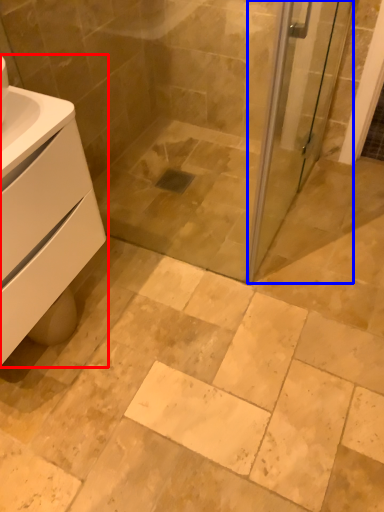
Question: Among these objects, which one is nearest to the camera, bathroom cabinet (highlighted by a red box) or screen door (highlighted by a blue box)?

Choices:
 (A) bathroom cabinet
 (B) screen door

Answer: (A)